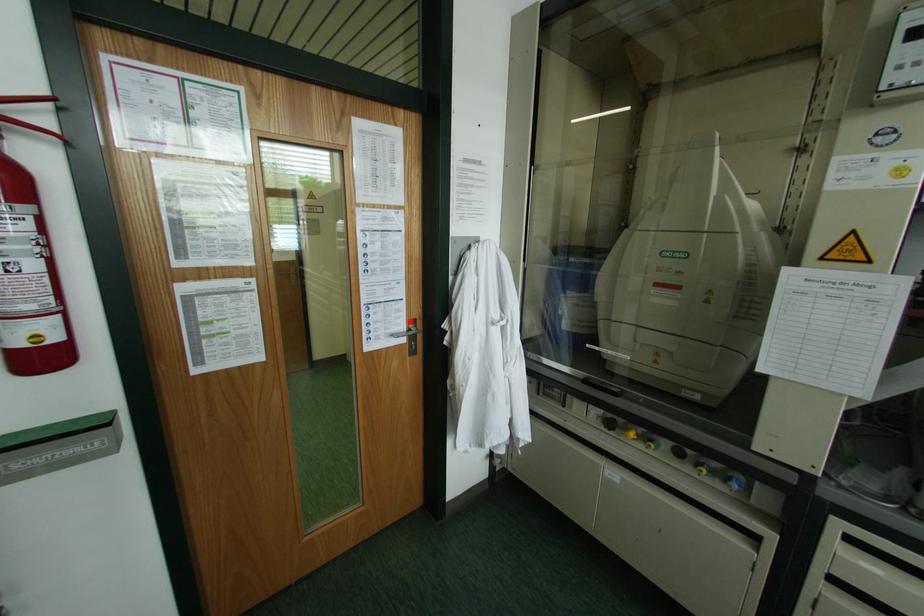
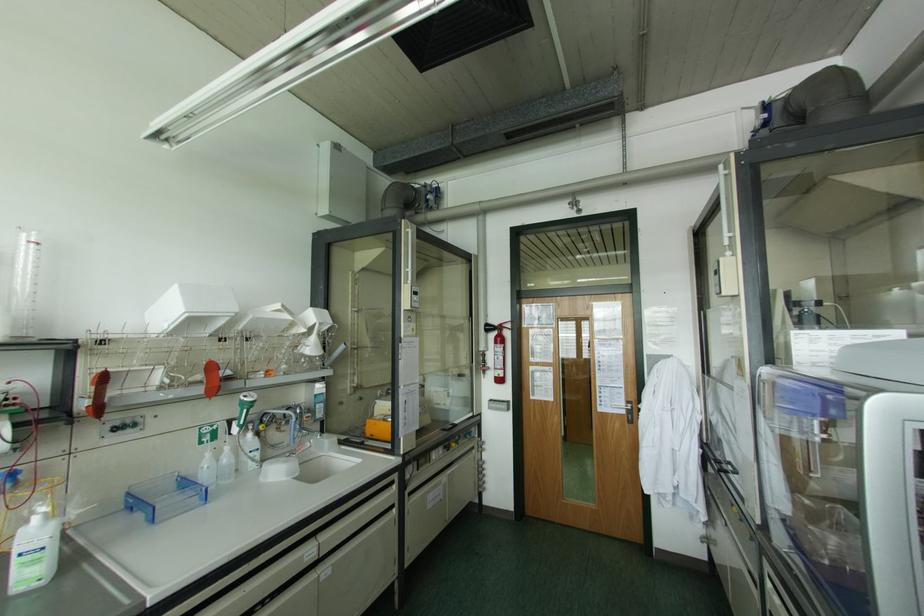
The point at the highlighted location is marked in the first image. Where is the corresponding point in the second image?

(626, 400)